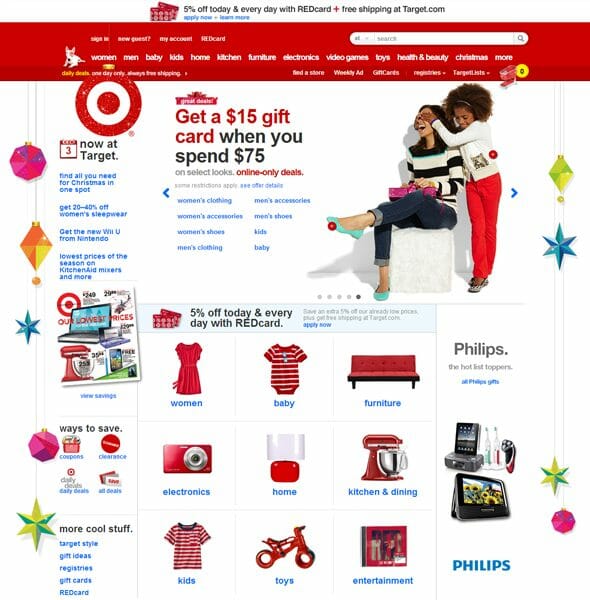
Find the location of a particular element. lamp shade is located at coordinates (291, 447).